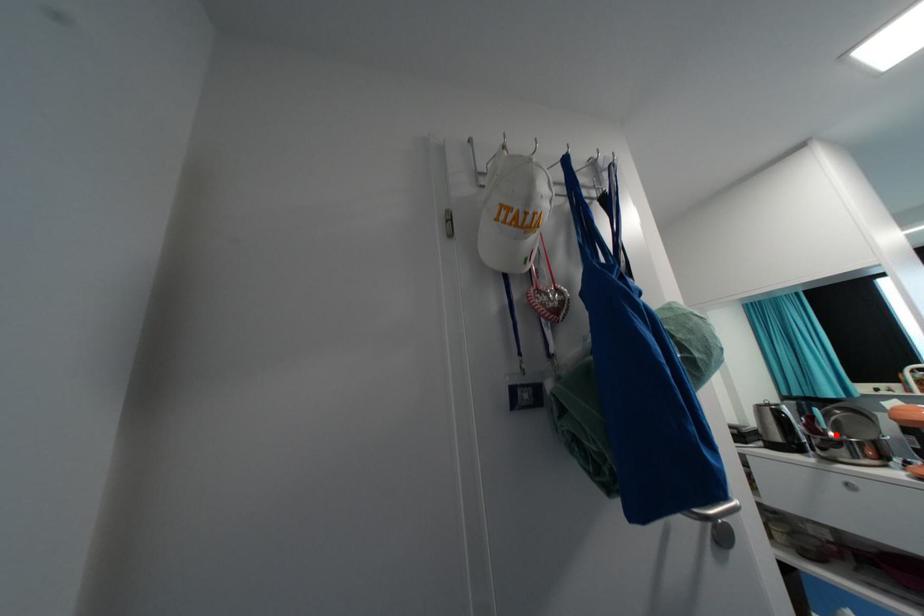
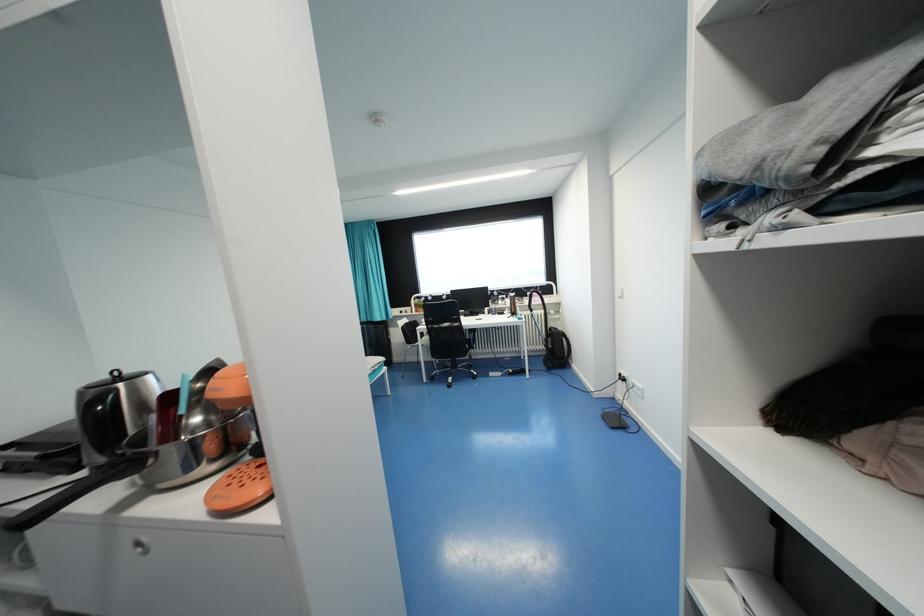
In the second image, find the point that corresponds to the highlighted location in the first image.

(201, 419)